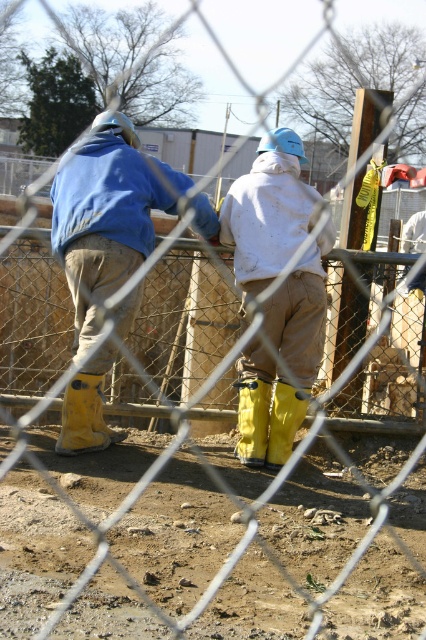
Question: Which point is farther to the camera?

Choices:
 (A) (279, 449)
 (B) (307, 394)
 (C) (83, 378)
 (D) (92, 445)

Answer: (B)

Question: Is white matte jacket at center behind yellow rubber boot at lower center?

Choices:
 (A) no
 (B) yes

Answer: (A)

Question: Which object is closer to the camera taking this photo?

Choices:
 (A) white matte jacket at center
 (B) yellow rubber boot at lower center
 (C) yellow rubber boot at lower left
 (D) matte blue jacket at left

Answer: (D)

Question: In this image, where is matte blue jacket at left located relative to yellow rubber boot at lower left?

Choices:
 (A) below
 (B) above

Answer: (B)

Question: Observing the image, what is the correct spatial positioning of matte blue jacket at left in reference to yellow rubber boot at center?

Choices:
 (A) right
 (B) left

Answer: (B)

Question: Among these points, which one is nearest to the camera?

Choices:
 (A) (287, 451)
 (B) (184, 173)
 (C) (100, 417)
 (D) (267, 189)

Answer: (A)